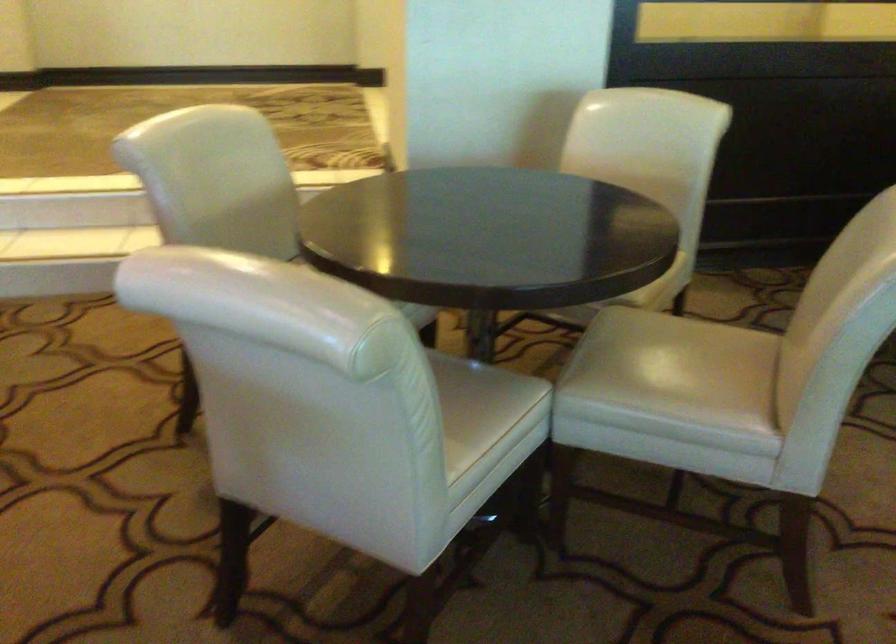
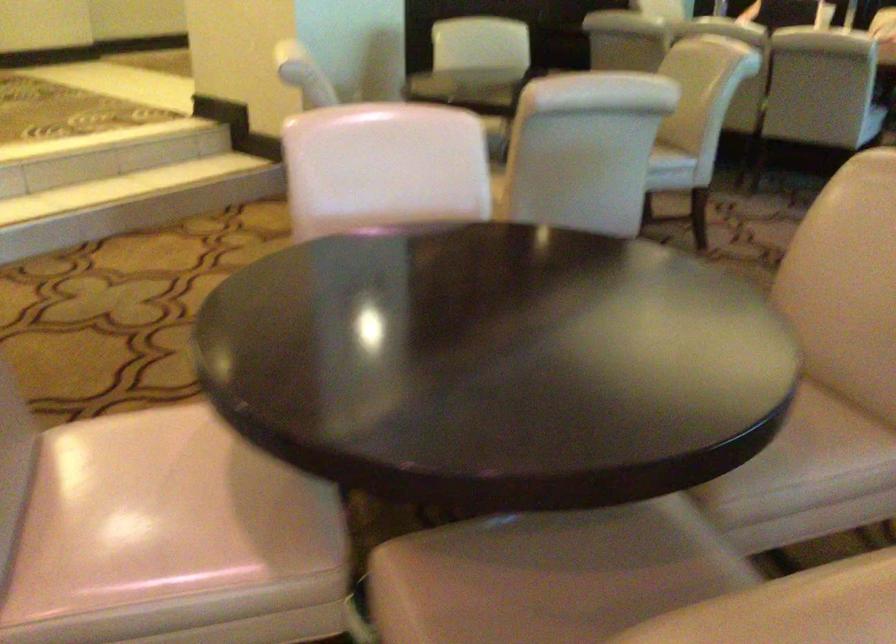
Locate, in the second image, the point that corresponds to pixel 716 440 in the first image.

(670, 163)